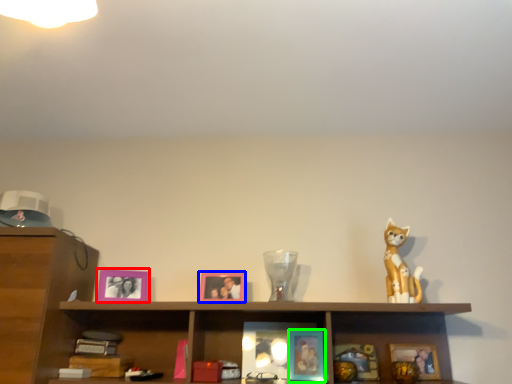
Question: Which is nearer to the picture frame (highlighted by a red box)? picture frame (highlighted by a blue box) or picture frame (highlighted by a green box).

Choices:
 (A) picture frame
 (B) picture frame

Answer: (A)